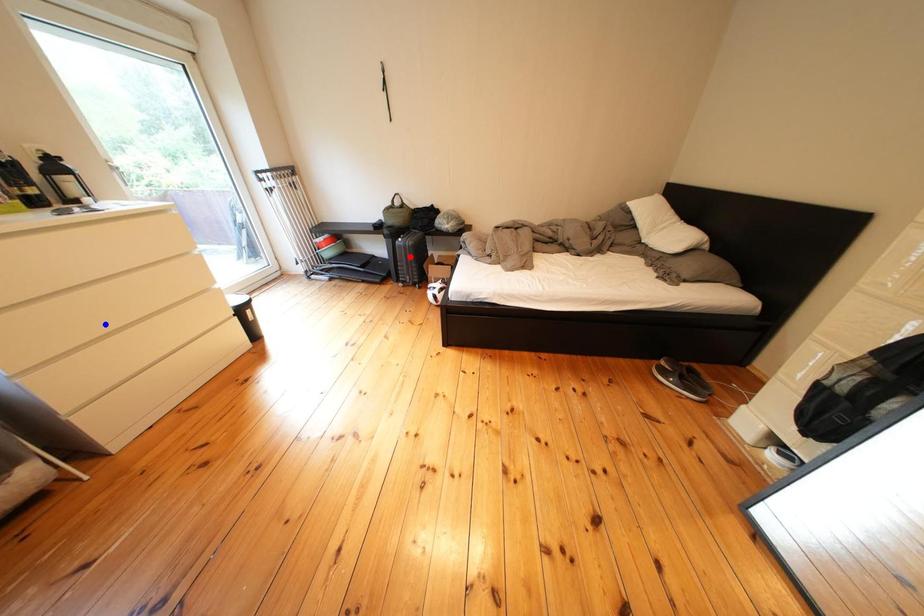
Question: Which of the two points in the image is closer to the camera?

Choices:
 (A) Blue point is closer.
 (B) Red point is closer.

Answer: (A)